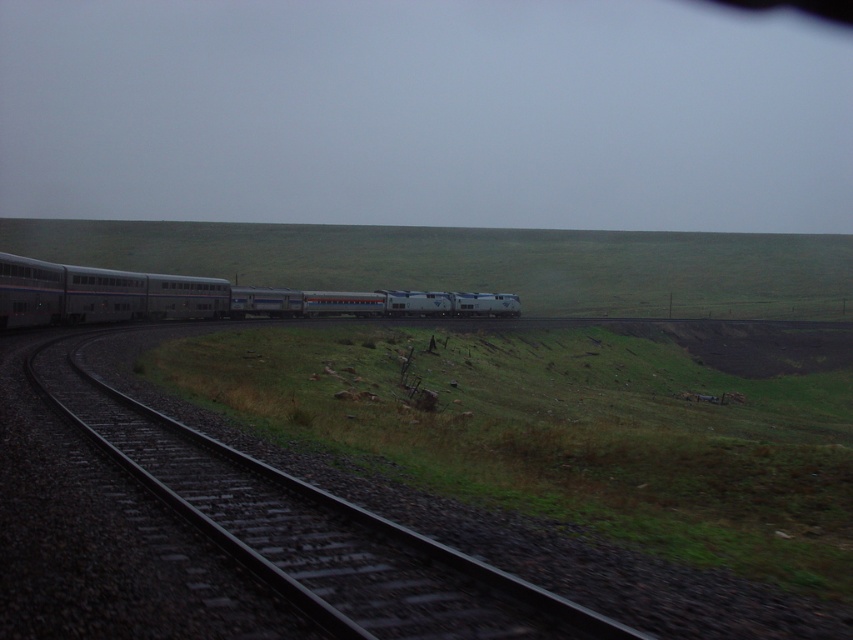
You are standing at the center of the image and want to locate the black metal track at center. What are the coordinates where it can be found?

The black metal track at center can be found at coordinates point (x=306, y=529).

You are standing on the platform waiting for the train. You see the black metal track at center and the silver metallic train at center. Which one is positioned more to the right side from your perspective?

The black metal track at center is positioned more to the right side from your perspective compared to the silver metallic train at center.